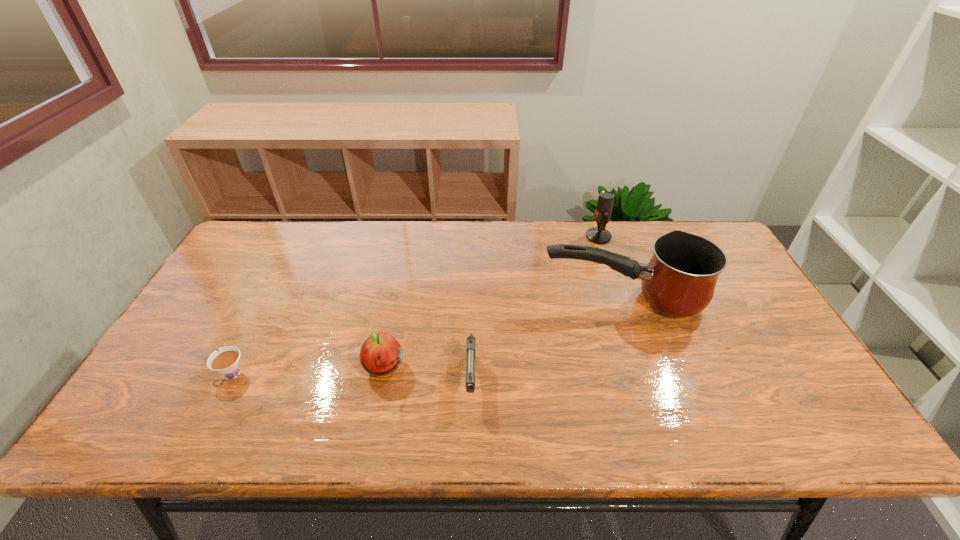
The image size is (960, 540). I want to click on free location located on the handle side of the tallest object, so click(471, 299).

In order to click on vacant area situated on the side of the farthest object with the red ring in this screenshot , I will do `click(560, 237)`.

The width and height of the screenshot is (960, 540). Identify the location of free spot located on the side of the farthest object with the red ring. (477, 237).

Locate an element on the screen. Image resolution: width=960 pixels, height=540 pixels. free spot located on the side of the farthest object with the red ring is located at coordinates (521, 237).

This screenshot has height=540, width=960. I want to click on vacant space located 0.250m on the back of the fourth object from right to left, so tap(400, 285).

The width and height of the screenshot is (960, 540). Find the location of `free spot located in the direction the gun is aimed`. free spot located in the direction the gun is aimed is located at coordinates (470, 440).

Identify the location of vacant space located on the side of the leftmost object with the handle. The width and height of the screenshot is (960, 540). (190, 374).

The image size is (960, 540). Find the location of `vacant area located on the side of the leftmost object with the handle`. vacant area located on the side of the leftmost object with the handle is located at coordinates (161, 374).

At what (x,y) coordinates should I click in order to perform the action: click on object at the far edge. Please return your answer as a coordinate pair (x, y). Looking at the image, I should click on (599, 235).

Where is `object that is positioned at the left edge`? The image size is (960, 540). object that is positioned at the left edge is located at coordinates (226, 361).